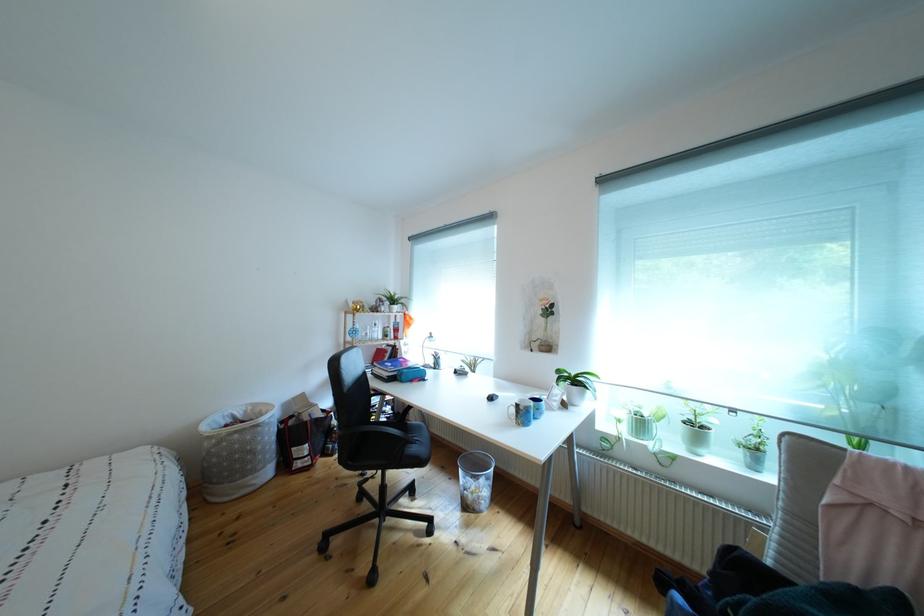
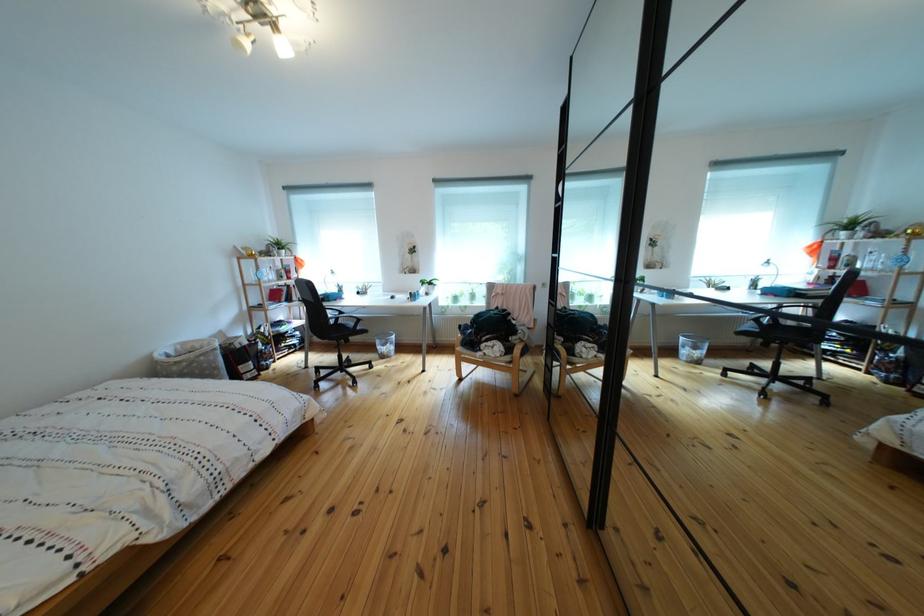
Locate, in the second image, the point that corresponds to (412,387) in the first image.

(341, 307)